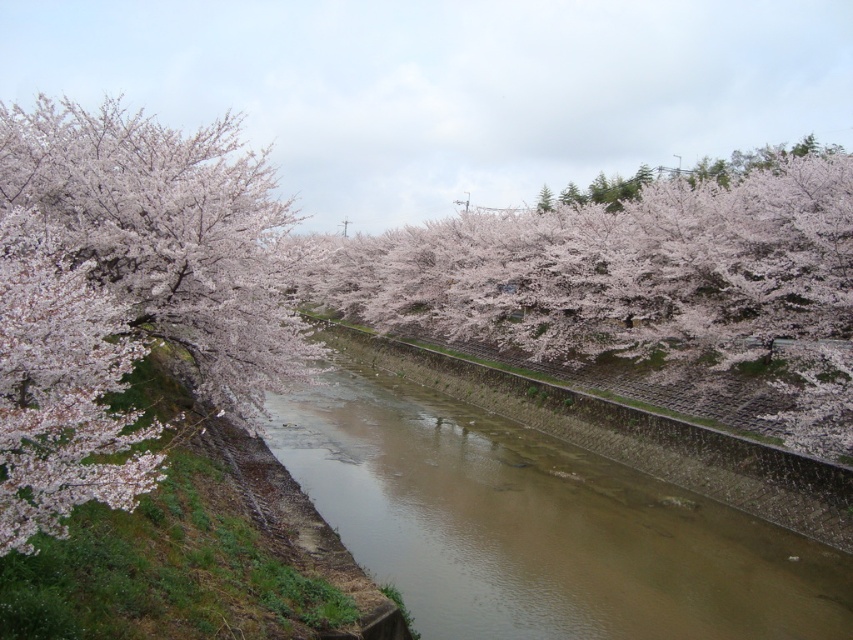
You are a boat captain navigating a small boat through the canal. You notice the brown concrete river at center and the pink blossoms at left. Which object is closer to the water surface?

The pink blossoms at left are closer to the water surface than the brown concrete river at center because the brown concrete river at center is shorter than pink blossoms at left.

You are standing on a bridge overlooking the canal and want to take a photo of the pink blossoms at left and the brown concrete river at center. Which object will appear closer to the camera in your photo?

The brown concrete river at center will appear closer to the camera in the photo because the pink blossoms at left are positioned behind it.